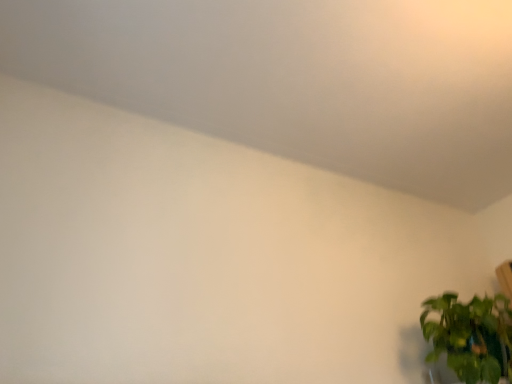
What is the approximate height of green leafy plant at lower right?

14.74 inches.

Identify the location of green leafy plant at lower right. The image size is (512, 384). (471, 336).

The height and width of the screenshot is (384, 512). Describe the element at coordinates (471, 336) in the screenshot. I see `green leafy plant at lower right` at that location.

This screenshot has width=512, height=384. Identify the location of green leafy plant at lower right. 471,336.